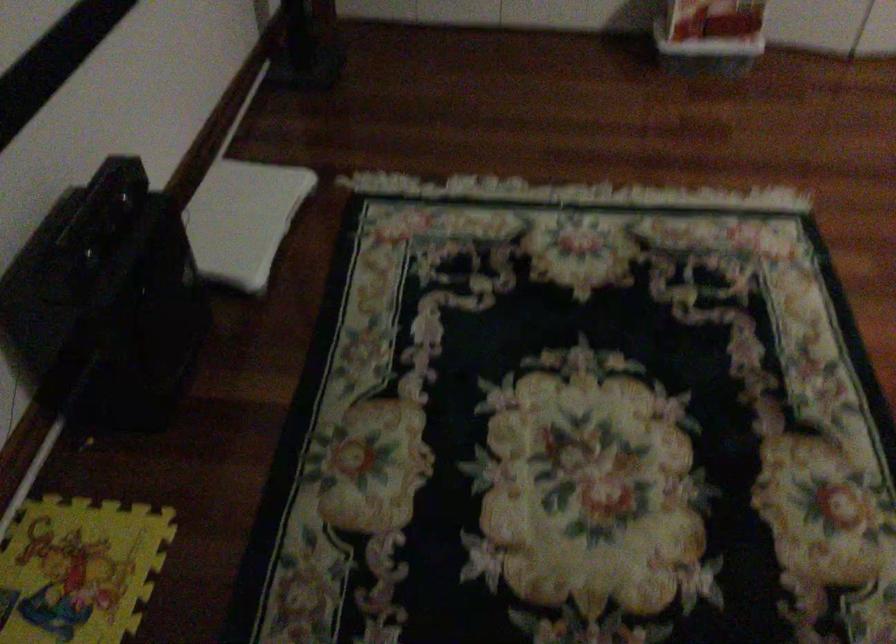
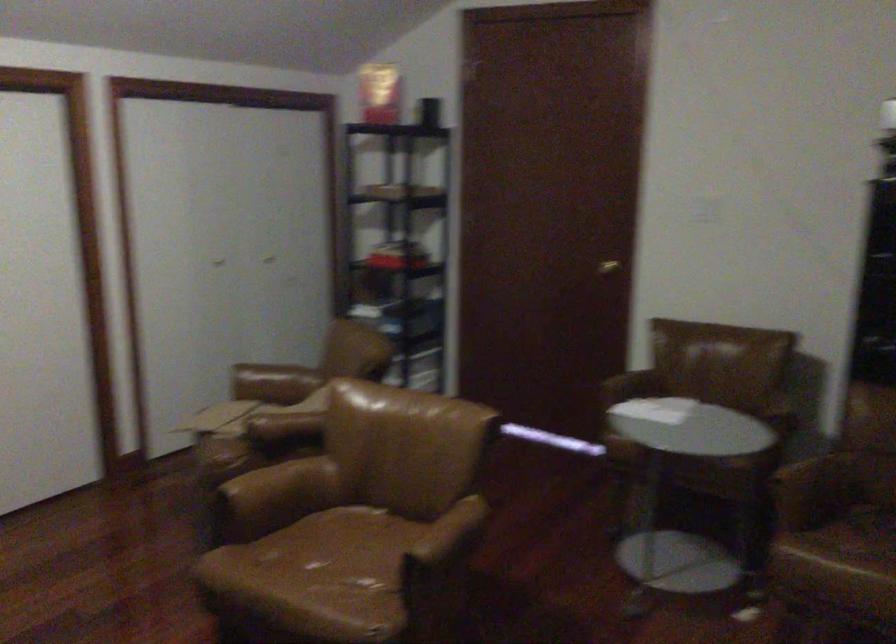
Question: The images are taken continuously from a first-person perspective. In which direction is your viewpoint rotating?

Choices:
 (A) Left
 (B) Right
 (C) Up
 (D) Down

Answer: (B)